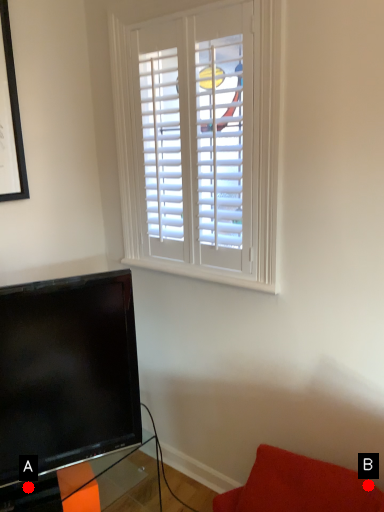
Question: Two points are circled on the image, labeled by A and B beside each circle. Among these points, which one is farthest from the camera?

Choices:
 (A) A is further
 (B) B is further

Answer: (A)